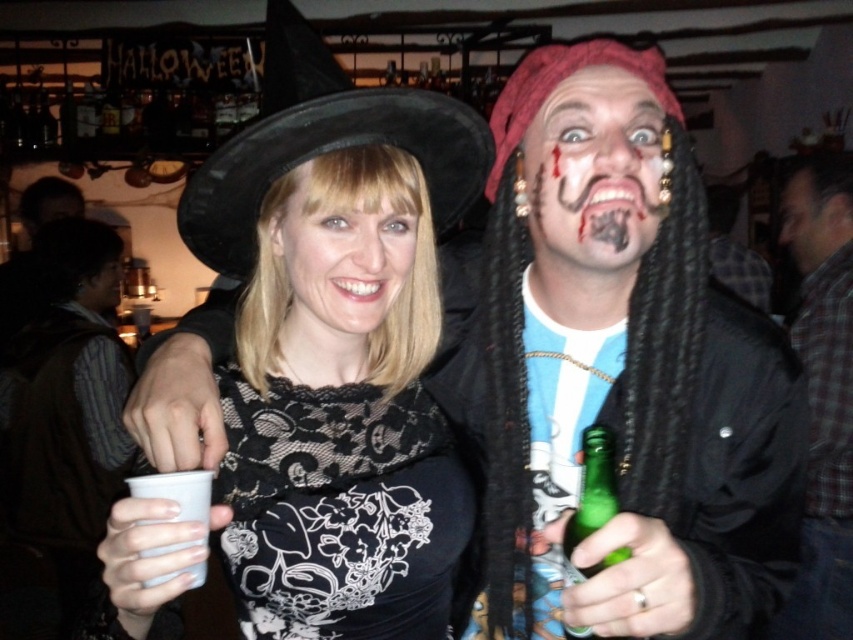
Can you confirm if black lace dress at center is shorter than plaid shirt at right?

Yes.

Does black lace dress at center appear on the left side of plaid shirt at right?

Yes, black lace dress at center is to the left of plaid shirt at right.

Locate an element on the screen. black lace dress at center is located at coordinates tap(340, 291).

Between black lace dress at center and smooth skin face at upper right, which one appears on the right side from the viewer's perspective?

Positioned to the right is smooth skin face at upper right.

Is black lace dress at center smaller than smooth skin face at upper right?

No, black lace dress at center is not smaller than smooth skin face at upper right.

Find the location of a particular element. black lace dress at center is located at coordinates (340, 291).

Where is `black lace dress at center`? The image size is (853, 640). black lace dress at center is located at coordinates (340, 291).

Does black lace dress at center have a smaller size compared to black felt witch hat at upper left?

No, black lace dress at center is not smaller than black felt witch hat at upper left.

Between point (351, 336) and point (305, 161), which one is positioned in front?

Point (305, 161) is more forward.

Where is `black lace dress at center`? The image size is (853, 640). black lace dress at center is located at coordinates [340, 291].